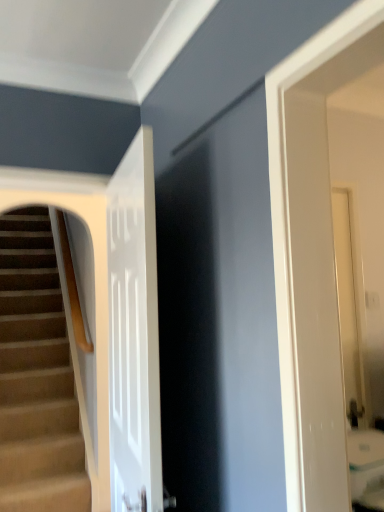
Question: Should I look upward or downward to see white glossy door at center?

Choices:
 (A) up
 (B) down

Answer: (B)

Question: Can carpeted stairs at left be found inside white glossy door at center?

Choices:
 (A) yes
 (B) no

Answer: (B)

Question: Is white glossy door at center not inside carpeted stairs at left?

Choices:
 (A) no
 (B) yes

Answer: (B)

Question: Is white glossy door at center thinner than carpeted stairs at left?

Choices:
 (A) yes
 (B) no

Answer: (A)

Question: Does white glossy door at center come in front of carpeted stairs at left?

Choices:
 (A) yes
 (B) no

Answer: (A)

Question: From a real-world perspective, is white glossy door at center located beneath carpeted stairs at left?

Choices:
 (A) yes
 (B) no

Answer: (B)

Question: Does white glossy door at center have a greater width compared to carpeted stairs at left?

Choices:
 (A) yes
 (B) no

Answer: (B)

Question: From the image's perspective, is carpeted stairs at left on white glossy door at center?

Choices:
 (A) yes
 (B) no

Answer: (B)

Question: Is carpeted stairs at left at the right side of white glossy door at center?

Choices:
 (A) yes
 (B) no

Answer: (B)

Question: Does carpeted stairs at left have a lesser height compared to white glossy door at center?

Choices:
 (A) yes
 (B) no

Answer: (B)

Question: From a real-world perspective, is carpeted stairs at left under white glossy door at center?

Choices:
 (A) yes
 (B) no

Answer: (A)

Question: Can you confirm if carpeted stairs at left is taller than white glossy door at center?

Choices:
 (A) yes
 (B) no

Answer: (A)

Question: From a real-world perspective, is carpeted stairs at left located higher than white glossy door at center?

Choices:
 (A) no
 (B) yes

Answer: (A)

Question: In terms of height, does white glossy door at center look taller or shorter compared to carpeted stairs at left?

Choices:
 (A) short
 (B) tall

Answer: (A)